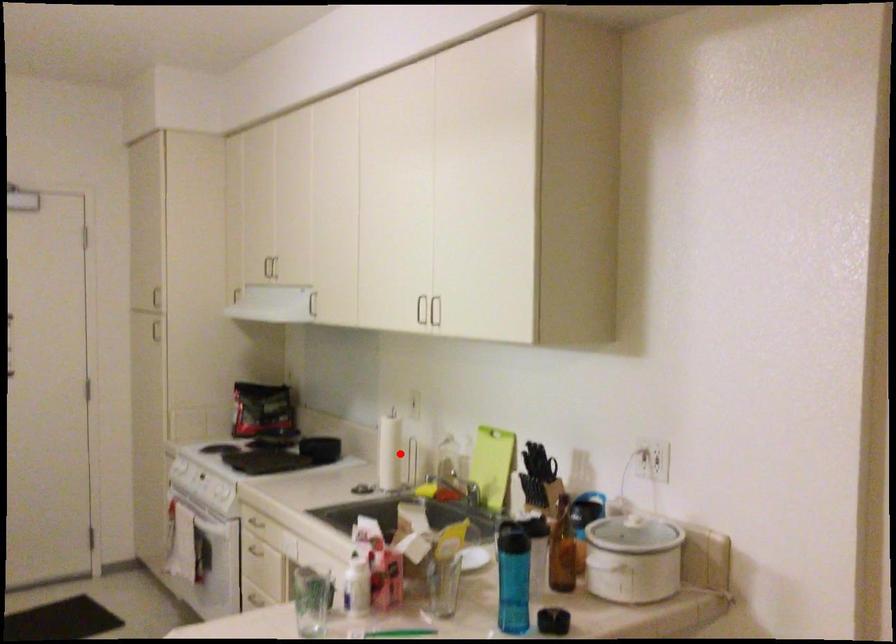
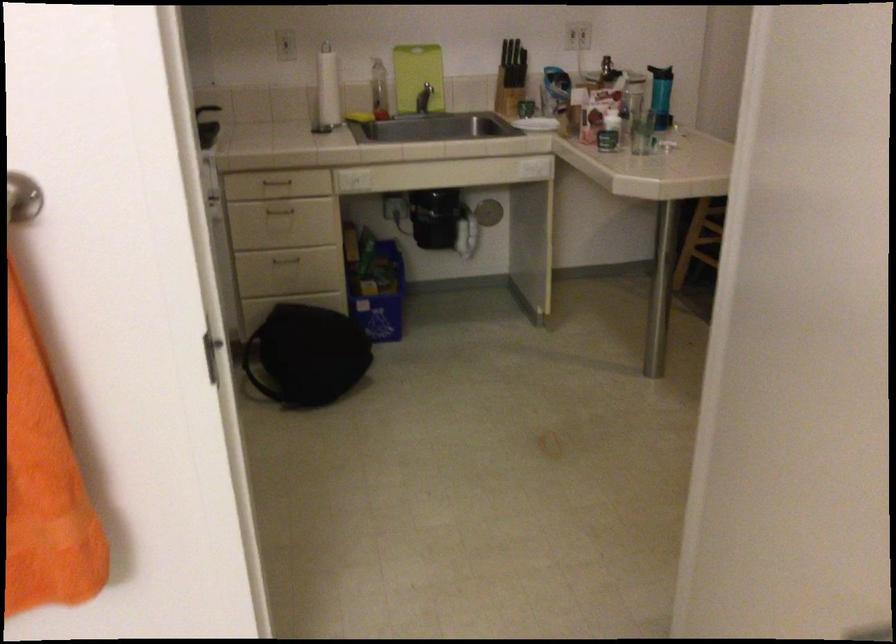
The point at the highlighted location is marked in the first image. Where is the corresponding point in the second image?

(328, 89)